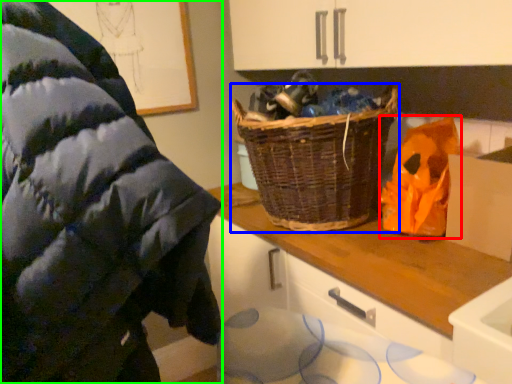
Question: Which object is the farthest from waste (highlighted by a red box)? Choose among these: picnic basket (highlighted by a blue box) or wool (highlighted by a green box).

Choices:
 (A) picnic basket
 (B) wool

Answer: (B)